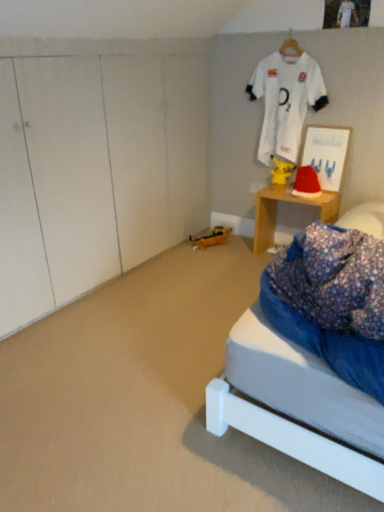
Locate an element on the screen. The width and height of the screenshot is (384, 512). free space to the left of red velvet santa hat at right is located at coordinates (287, 191).